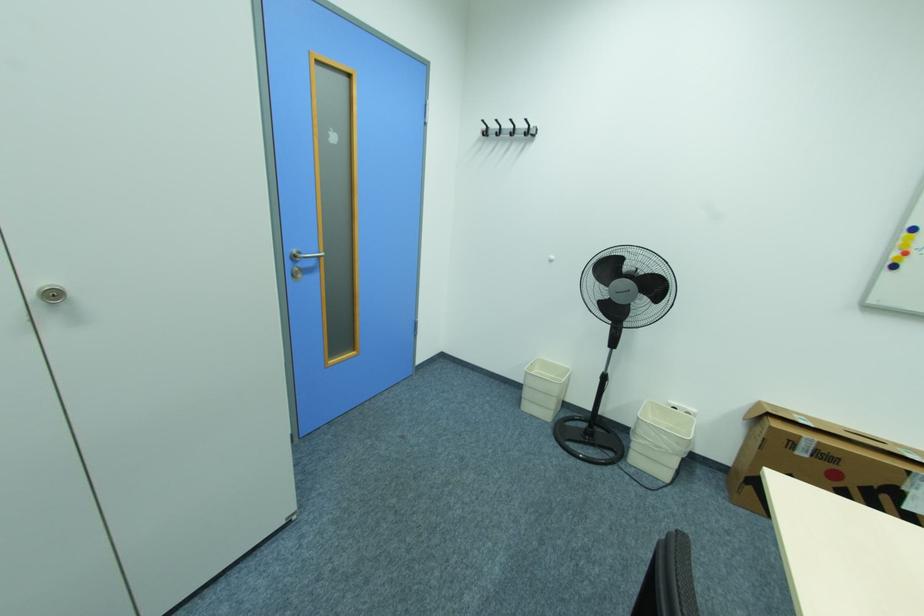
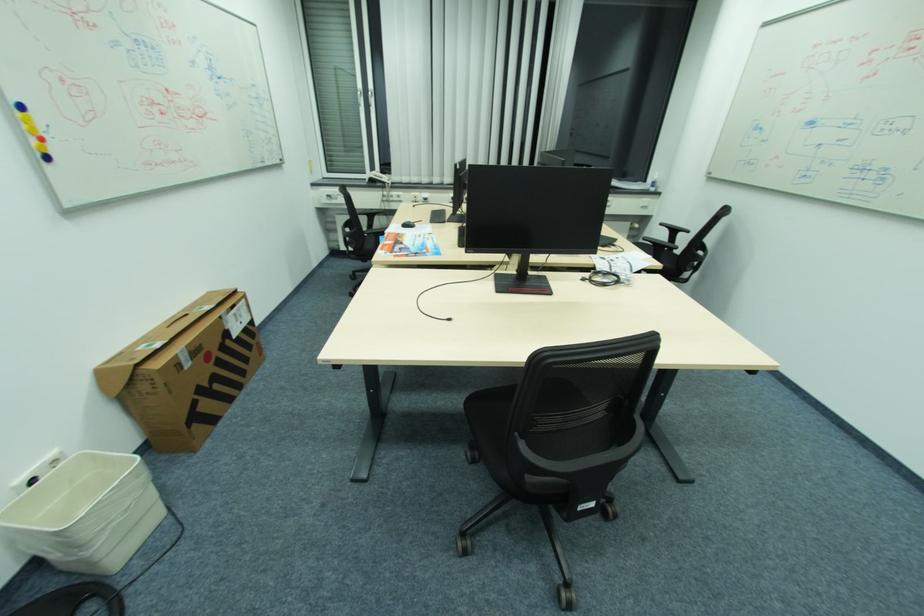
Find the pixel in the second image that matches pixel 805 437 in the first image.

(181, 355)